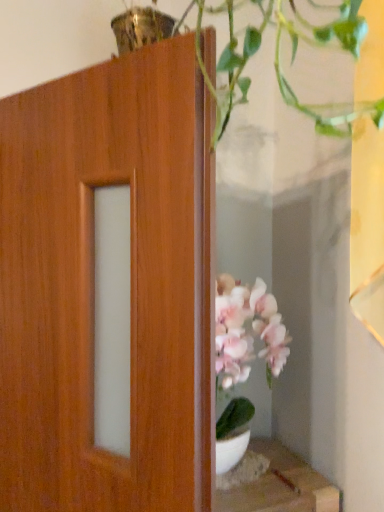
Image resolution: width=384 pixels, height=512 pixels. I want to click on wooden door at center, so click(93, 284).

Describe the element at coordinates (93, 284) in the screenshot. I see `wooden door at center` at that location.

Image resolution: width=384 pixels, height=512 pixels. I want to click on wooden door at center, so click(x=93, y=284).